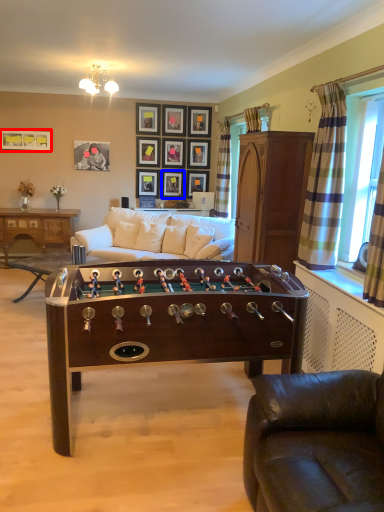
Question: Which of the following is the farthest to the observer, picture frame (highlighted by a red box) or picture frame (highlighted by a blue box)?

Choices:
 (A) picture frame
 (B) picture frame

Answer: (B)